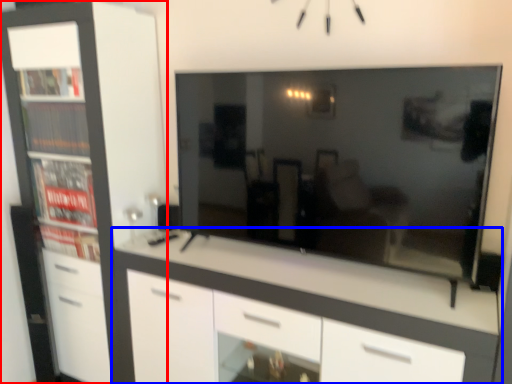
Question: Which object is further to the camera taking this photo, cabinetry (highlighted by a red box) or chest of drawers (highlighted by a blue box)?

Choices:
 (A) cabinetry
 (B) chest of drawers

Answer: (A)